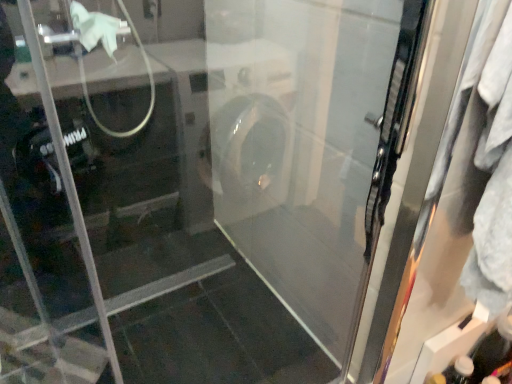
Measure the distance between transparent plastic bottle at lower right and camera.

transparent plastic bottle at lower right is 4.01 feet from camera.

What is the approximate height of transparent plastic bottle at lower right?

The height of transparent plastic bottle at lower right is 14.59 inches.

What do you see at coordinates (481, 358) in the screenshot? I see `transparent plastic bottle at lower right` at bounding box center [481, 358].

Locate an element on the screen. This screenshot has width=512, height=384. transparent plastic bottle at lower right is located at coordinates pyautogui.click(x=481, y=358).

Image resolution: width=512 pixels, height=384 pixels. What do you see at coordinates (437, 194) in the screenshot? I see `clear glass screen door at right` at bounding box center [437, 194].

Find the location of `clear glass screen door at right`. clear glass screen door at right is located at coordinates (437, 194).

Image resolution: width=512 pixels, height=384 pixels. I want to click on transparent plastic bottle at lower right, so click(481, 358).

Would you say transparent plastic bottle at lower right is to the left or to the right of clear glass screen door at right in the picture?

Based on their positions, transparent plastic bottle at lower right is located to the right of clear glass screen door at right.

Who is more distant, transparent plastic bottle at lower right or clear glass screen door at right?

Positioned behind is transparent plastic bottle at lower right.

Which is behind, point (452, 356) or point (390, 342)?

The point (452, 356) is farther.

From the image's perspective, does transparent plastic bottle at lower right appear lower than clear glass screen door at right?

Yes, from the image's perspective, transparent plastic bottle at lower right is beneath clear glass screen door at right.

From a real-world perspective, who is located higher, transparent plastic bottle at lower right or clear glass screen door at right?

From a 3D spatial view, clear glass screen door at right is above.

Which of these two, transparent plastic bottle at lower right or clear glass screen door at right, is thinner?

transparent plastic bottle at lower right.

Which of these two, transparent plastic bottle at lower right or clear glass screen door at right, stands shorter?

Standing shorter between the two is transparent plastic bottle at lower right.

Can you confirm if transparent plastic bottle at lower right is smaller than clear glass screen door at right?

Yes.

Is transparent plastic bottle at lower right surrounding clear glass screen door at right?

No, clear glass screen door at right is not surrounded by transparent plastic bottle at lower right.

Is there a large distance between transparent plastic bottle at lower right and clear glass screen door at right?

No, transparent plastic bottle at lower right is not far away from clear glass screen door at right.

Is transparent plastic bottle at lower right oriented towards clear glass screen door at right?

No.

What's the angular difference between transparent plastic bottle at lower right and clear glass screen door at right's facing directions?

The angle between the facing direction of transparent plastic bottle at lower right and the facing direction of clear glass screen door at right is 1.11 degrees.

In the image, there is a transparent plastic bottle at lower right. Where is `screen door above it (from the image's perspective)`? screen door above it (from the image's perspective) is located at coordinates (437, 194).

Between clear glass screen door at right and transparent plastic bottle at lower right, which one appears on the right side from the viewer's perspective?

transparent plastic bottle at lower right.

Is the depth of clear glass screen door at right less than that of transparent plastic bottle at lower right?

Yes.

Does point (453, 130) come behind point (505, 328)?

No, (453, 130) is in front of (505, 328).

From the image's perspective, is clear glass screen door at right above transparent plastic bottle at lower right?

Yes, from the image's perspective, clear glass screen door at right is above transparent plastic bottle at lower right.

From a real-world perspective, is clear glass screen door at right under transparent plastic bottle at lower right?

No, from a real-world perspective, clear glass screen door at right is not below transparent plastic bottle at lower right.

Considering the sizes of objects clear glass screen door at right and transparent plastic bottle at lower right in the image provided, who is wider, clear glass screen door at right or transparent plastic bottle at lower right?

With larger width is clear glass screen door at right.

Between clear glass screen door at right and transparent plastic bottle at lower right, which one has less height?

With less height is transparent plastic bottle at lower right.

Considering the relative sizes of clear glass screen door at right and transparent plastic bottle at lower right in the image provided, is clear glass screen door at right smaller than transparent plastic bottle at lower right?

No.

Would you say clear glass screen door at right is outside transparent plastic bottle at lower right?

That's correct, clear glass screen door at right is outside of transparent plastic bottle at lower right.

Is clear glass screen door at right far from transparent plastic bottle at lower right?

No, clear glass screen door at right is not far from transparent plastic bottle at lower right.

Is clear glass screen door at right turned away from transparent plastic bottle at lower right?

No, clear glass screen door at right is not facing away from transparent plastic bottle at lower right.

Where is `bottle that is under the clear glass screen door at right (from a real-world perspective)`? bottle that is under the clear glass screen door at right (from a real-world perspective) is located at coordinates (481, 358).

Where is `screen door on the left of transparent plastic bottle at lower right`? The height and width of the screenshot is (384, 512). screen door on the left of transparent plastic bottle at lower right is located at coordinates (437, 194).

This screenshot has width=512, height=384. Find the location of `screen door lying above the transparent plastic bottle at lower right (from the image's perspective)`. screen door lying above the transparent plastic bottle at lower right (from the image's perspective) is located at coordinates (437, 194).